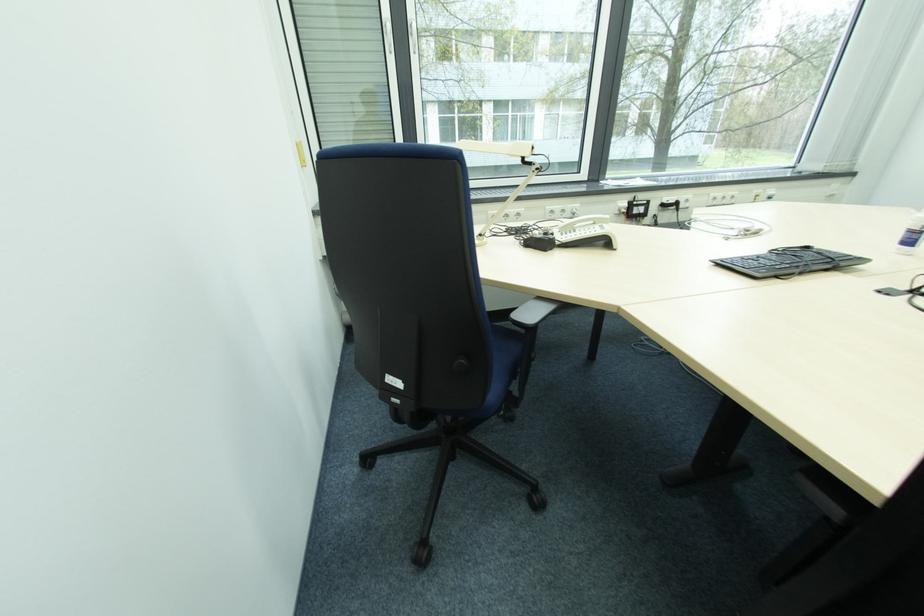
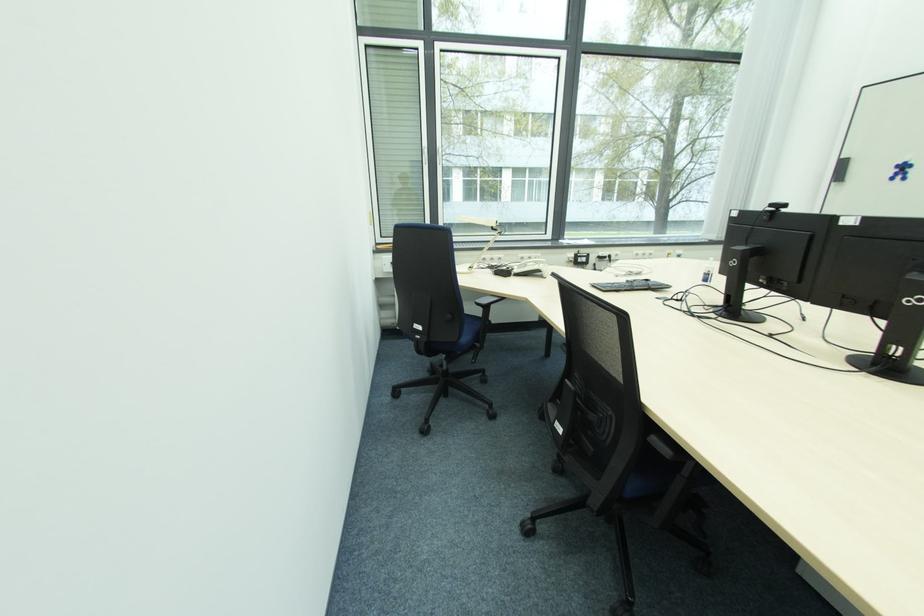
Locate, in the second image, the point that corresponds to (529,161) in the first image.

(497, 230)